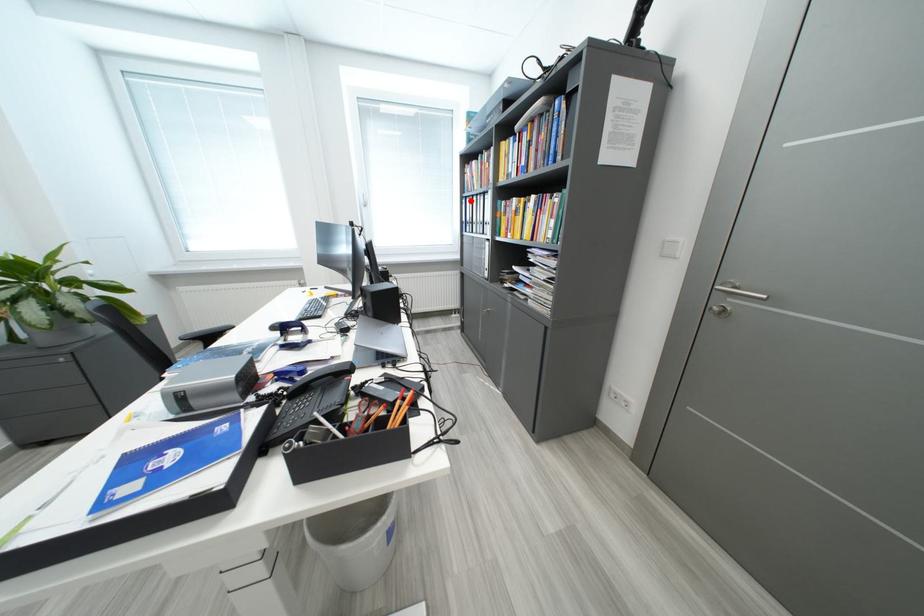
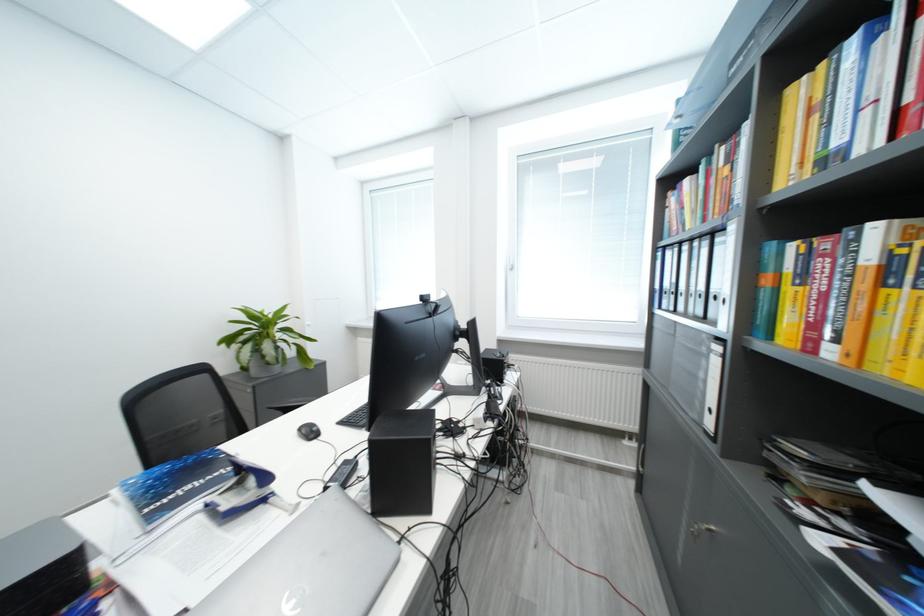
In the second image, find the point that corresponds to the highlighted location in the first image.

(664, 253)